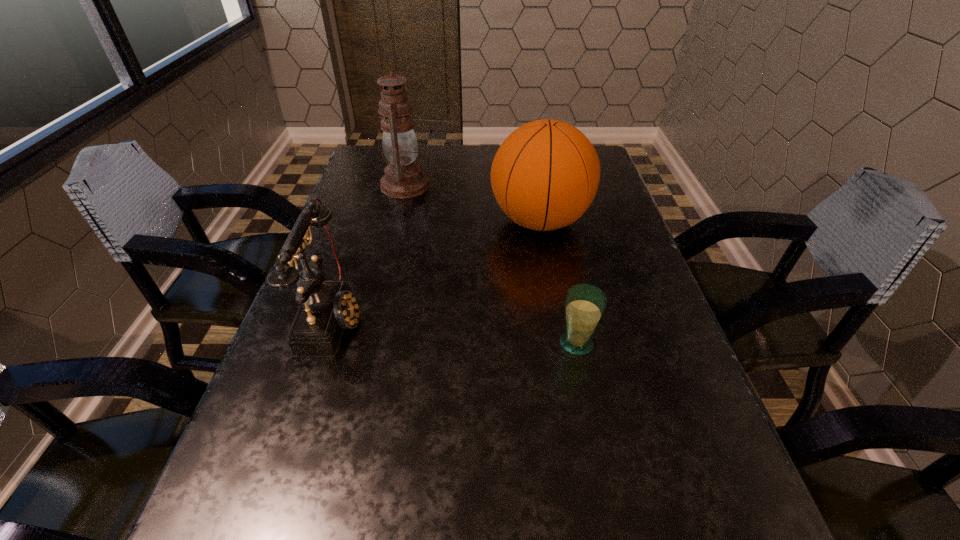
Find the location of a particular element. The width and height of the screenshot is (960, 540). telephone positioned at the left edge is located at coordinates (327, 308).

Where is `basketball that is at the right edge`? The width and height of the screenshot is (960, 540). basketball that is at the right edge is located at coordinates (545, 175).

Locate an element on the screen. The height and width of the screenshot is (540, 960). glass at the right edge is located at coordinates pyautogui.click(x=584, y=305).

This screenshot has width=960, height=540. Find the location of `object positioned at the far left corner`. object positioned at the far left corner is located at coordinates (404, 178).

Where is `free space at the far edge`? Image resolution: width=960 pixels, height=540 pixels. free space at the far edge is located at coordinates (454, 174).

In the image, there is a desktop. Identify the location of vacant space at the left edge. The height and width of the screenshot is (540, 960). (347, 348).

You are a GUI agent. You are given a task and a screenshot of the screen. Output one action in this format:
    pyautogui.click(x=<x>, y=<y>)
    Task: Click on the free space at the right edge
    This screenshot has width=960, height=540.
    Given the screenshot: What is the action you would take?
    [x=650, y=426]

Locate an element on the screen. This screenshot has height=540, width=960. vacant space at the far left corner of the desktop is located at coordinates tap(380, 173).

Find the location of `free area in between the tallest object and the telephone`. free area in between the tallest object and the telephone is located at coordinates (370, 252).

Locate an element on the screen. free space that is in between the basketball and the telephone is located at coordinates (437, 269).